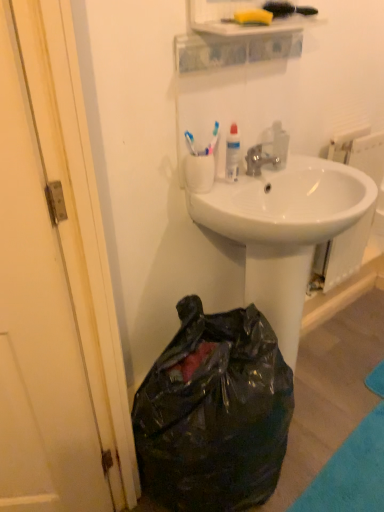
Question: From the image's perspective, is white glossy sink at center positioned above or below silver metallic faucet at center?

Choices:
 (A) below
 (B) above

Answer: (A)

Question: Looking at the image, does white glossy sink at center seem bigger or smaller compared to silver metallic faucet at center?

Choices:
 (A) big
 (B) small

Answer: (A)

Question: Based on their relative distances, which object is farther from the white plastic cup at upper center?

Choices:
 (A) white glossy radiator at upper right
 (B) white glossy sink at center
 (C) black plastic bag at lower left
 (D) silver metallic faucet at center

Answer: (A)

Question: Considering the real-world distances, which object is farthest from the white glossy sink at center?

Choices:
 (A) silver metallic faucet at center
 (B) white plastic cup at upper center
 (C) white glossy radiator at upper right
 (D) black plastic bag at lower left

Answer: (C)